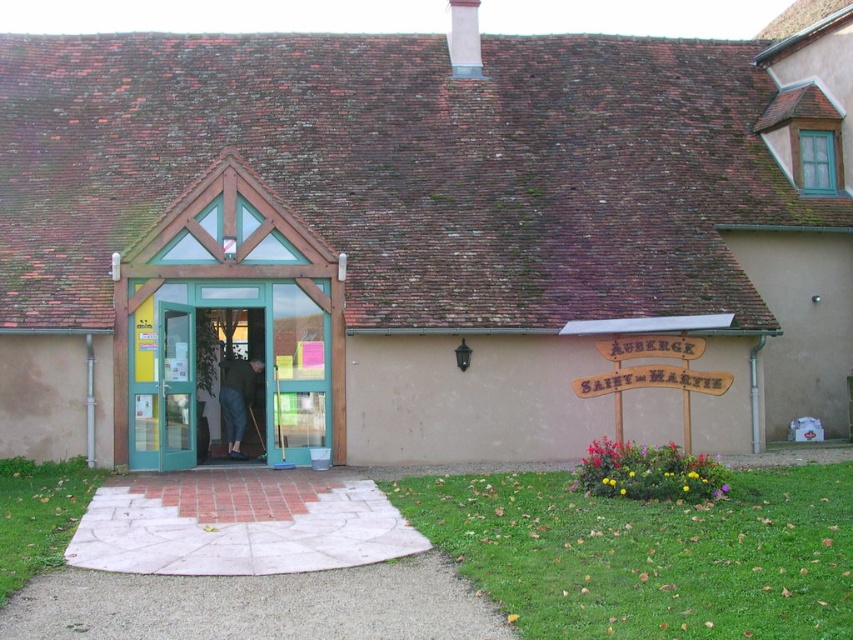
Is green glass door at center thinner than transparent glass door at center?

No, green glass door at center is not thinner than transparent glass door at center.

Measure the distance between green glass door at center and camera.

A distance of 16.09 meters exists between green glass door at center and camera.

Who is more forward, (195, 378) or (175, 388)?

Point (175, 388) is in front.

This screenshot has width=853, height=640. I want to click on green glass door at center, so click(x=230, y=368).

Is the position of green glass door at center more distant than that of dark blue jeans at center?

No, it is not.

Is point (316, 429) in front of point (242, 378)?

That is True.

Identify the location of green glass door at center. (230, 368).

Is point (172, 321) positioned after point (234, 458)?

No, it is not.

Does transparent glass door at center appear on the right side of dark blue jeans at center?

No, transparent glass door at center is not to the right of dark blue jeans at center.

Image resolution: width=853 pixels, height=640 pixels. I want to click on transparent glass door at center, so coord(175,387).